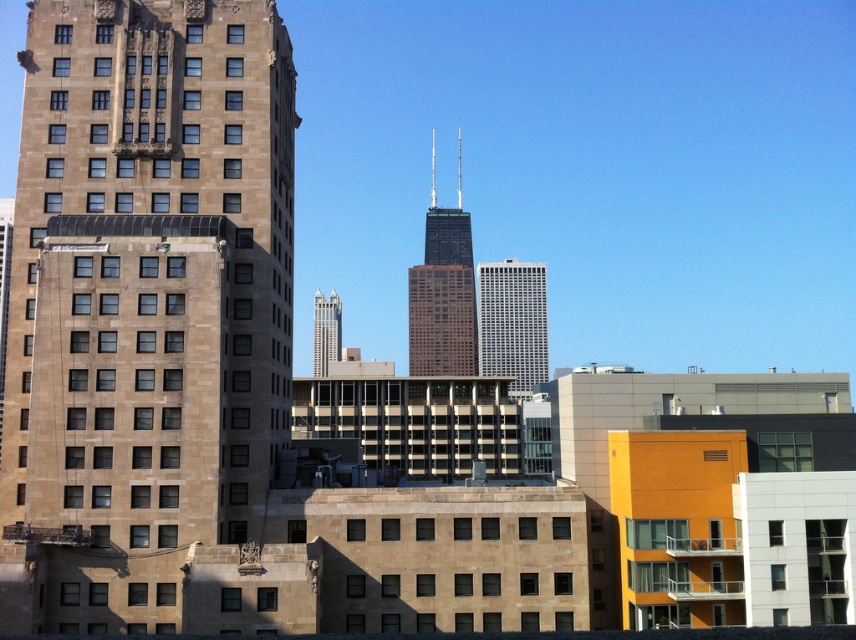
Consider the image. Can you confirm if brown glassy tower at center is positioned above matte glass skyscraper at center?

Indeed, brown glassy tower at center is positioned over matte glass skyscraper at center.

Who is more forward, (417, 339) or (333, 358)?

Point (417, 339)

At what (x,y) coordinates should I click in order to perform the action: click on brown glassy tower at center. Please return your answer as a coordinate pair (x, y). Looking at the image, I should click on tap(443, 296).

What do you see at coordinates (443, 296) in the screenshot? I see `brown glassy tower at center` at bounding box center [443, 296].

Does brown glassy tower at center have a greater height compared to white glass building at center?

Correct, brown glassy tower at center is much taller as white glass building at center.

Between point (459, 244) and point (538, 353), which one is positioned in front?

Point (538, 353)

The image size is (856, 640). In order to click on brown glassy tower at center in this screenshot , I will do `click(443, 296)`.

Between white glass building at center and matte glass skyscraper at center, which one appears on the left side from the viewer's perspective?

From the viewer's perspective, matte glass skyscraper at center appears more on the left side.

Find the location of a particular element. This screenshot has width=856, height=640. white glass building at center is located at coordinates (512, 323).

Is point (539, 282) positioned before point (328, 348)?

Yes, it is in front of point (328, 348).

Locate an element on the screen. white glass building at center is located at coordinates (512, 323).